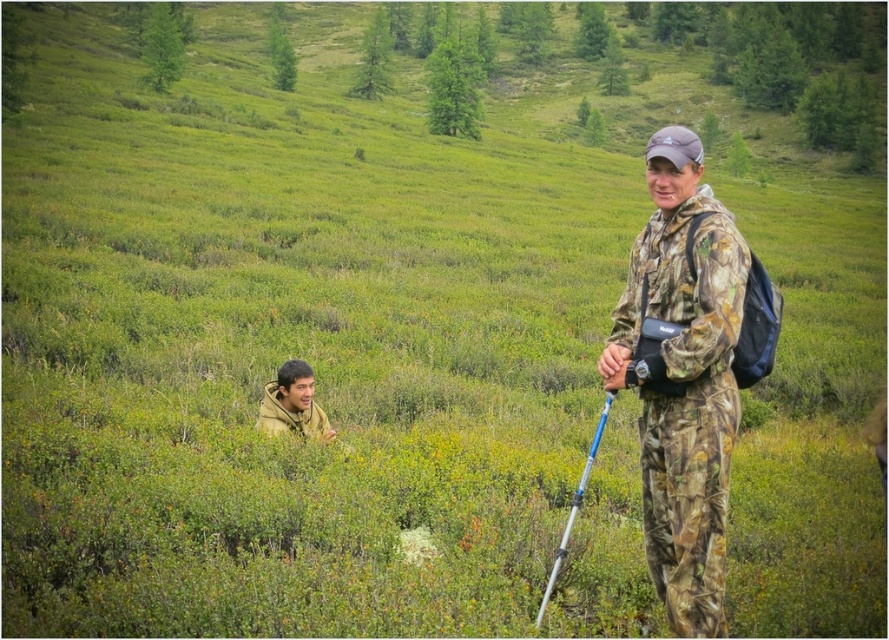
Question: Can you confirm if camo-patterned jacket at center is positioned below silver metallic ski pole at center?

Choices:
 (A) yes
 (B) no

Answer: (B)

Question: Which point appears farthest from the camera in this image?

Choices:
 (A) (259, 412)
 (B) (686, 291)

Answer: (A)

Question: Does camo-patterned jacket at center have a larger size compared to silver metallic ski pole at center?

Choices:
 (A) yes
 (B) no

Answer: (A)

Question: Which object is farther from the camera taking this photo?

Choices:
 (A) camouflage jacket at lower left
 (B) camo-patterned jacket at center

Answer: (A)

Question: In this image, where is camouflage jacket at lower left located relative to silver metallic ski pole at center?

Choices:
 (A) right
 (B) left

Answer: (B)

Question: Which object is positioned closest to the silver metallic ski pole at center?

Choices:
 (A) camouflage jacket at lower left
 (B) camo-patterned jacket at center

Answer: (B)